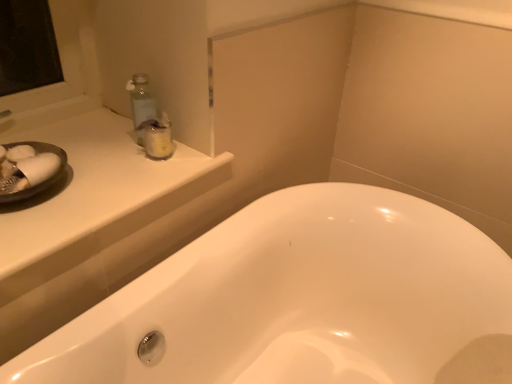
Locate an element on the screen. This screenshot has width=512, height=384. free space in front of clear plastic jar at upper left is located at coordinates (130, 185).